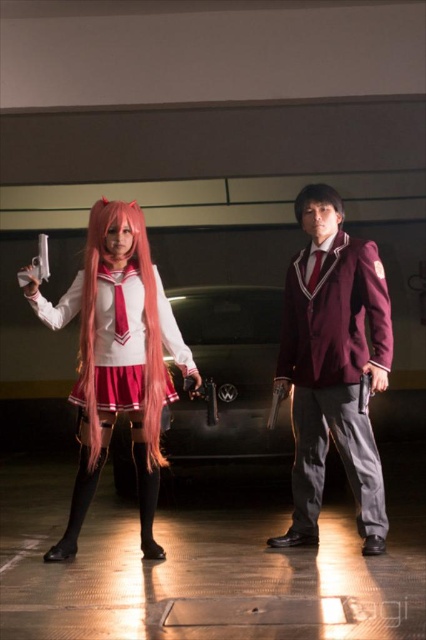
In the scene shown: Does maroon fabric suit at center appear under pink silky wig at center?

Yes.

From the picture: Who is shorter, maroon fabric suit at center or pink silky wig at center?

pink silky wig at center is shorter.

Does point (362, 496) come behind point (146, 288)?

No, it is not.

I want to click on maroon fabric suit at center, so click(333, 372).

Which is behind, point (115, 268) or point (298, 200)?

The point (298, 200) is behind.

Is matte pink wig at center taller than black silky hair at center?

Indeed, matte pink wig at center has a greater height compared to black silky hair at center.

This screenshot has height=640, width=426. Describe the element at coordinates (118, 358) in the screenshot. I see `matte pink wig at center` at that location.

What are the coordinates of `matte pink wig at center` in the screenshot? It's located at (118, 358).

Can you confirm if matte pink wig at center is shorter than pink silky wig at center?

In fact, matte pink wig at center may be taller than pink silky wig at center.

Consider the image. Between matte pink wig at center and pink silky wig at center, which one is positioned lower?

Positioned lower is matte pink wig at center.

Does point (75, 296) come closer to viewer compared to point (138, 262)?

Yes, it is in front of point (138, 262).

What are the coordinates of `matte pink wig at center` in the screenshot? It's located at (118, 358).